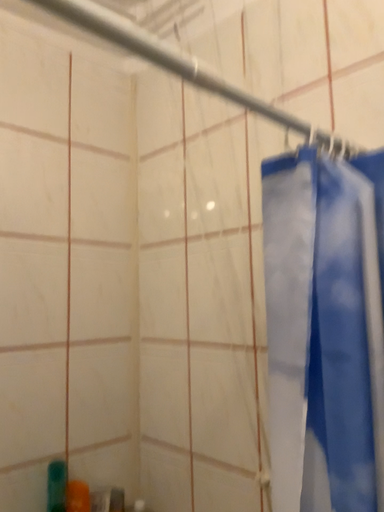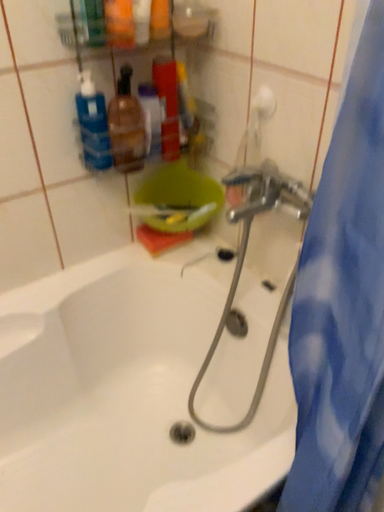
Question: How did the camera likely rotate when shooting the video?

Choices:
 (A) rotated downward
 (B) rotated upward

Answer: (A)